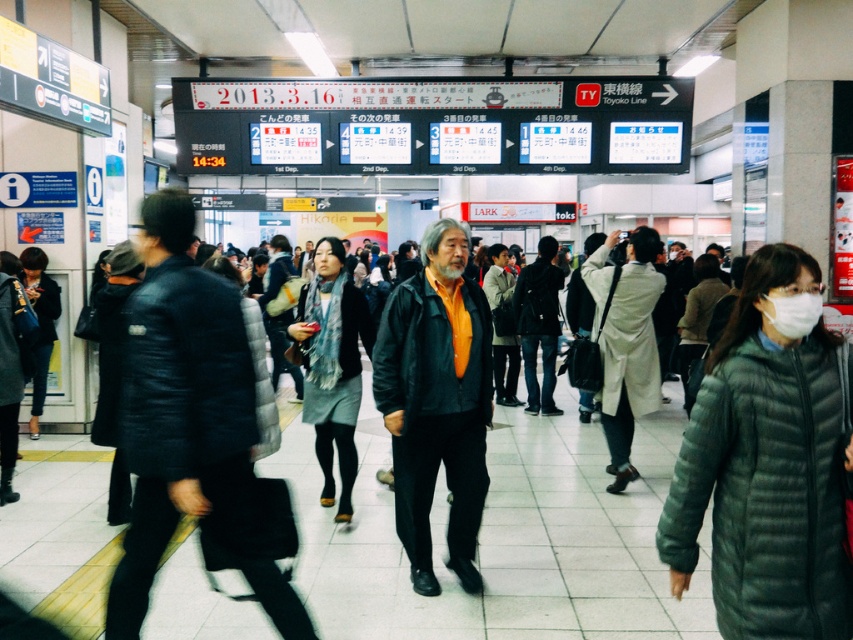
You are a photographer holding a camera. You want to take a photo of the gray down jacket at right without moving the camera. Is the jacket within the camera lens range of 2 meters?

The gray down jacket at right and camera are 2.38 meters apart from each other. Since the camera lens range is 2 meters, the jacket is slightly out of range and cannot be captured clearly without moving the camera.

You are standing at the camera position in the train station scene. There is a gray down jacket at right. Can you reach the jacket without moving your feet?

The gray down jacket at right is 7.82 feet away from the camera, so you cannot reach it without moving your feet since that distance is too far.

You are a photographer standing in the train station and want to take a photo of both the gray down jacket at right and the matte black jacket at center. Since you want both subjects to appear clearly in the photo, which jacket should you focus on to ensure both are in sharp focus?

You should focus on the matte black jacket at center because it is farther from the camera than the gray down jacket at right. By focusing on the farther subject, the near subject will also be in focus due to the depth of field.